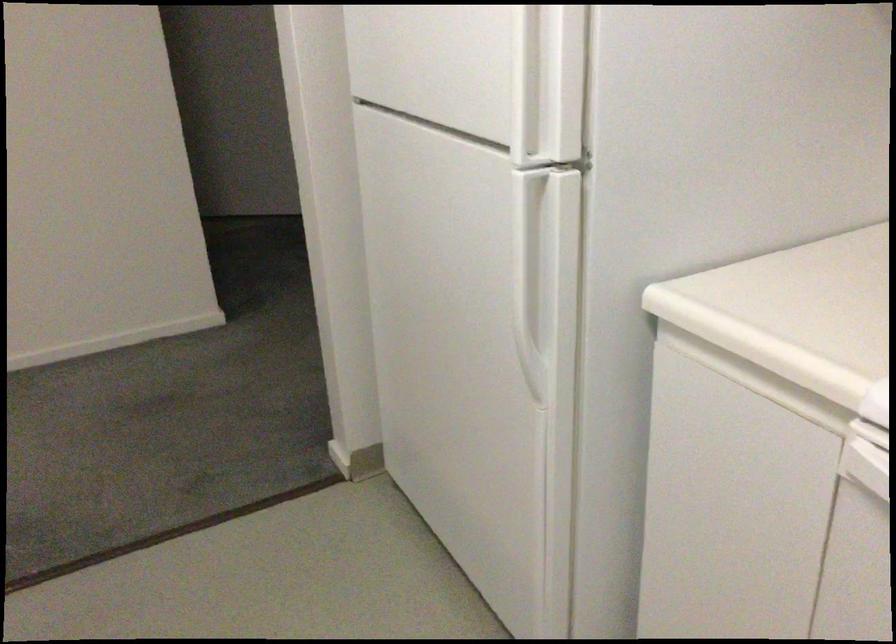
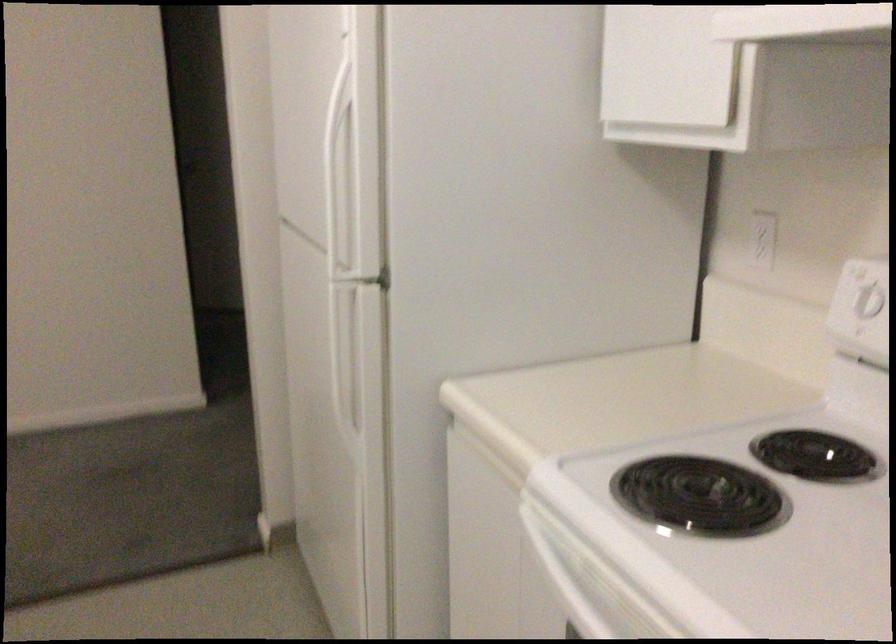
In the second image, find the point that corresponds to point 521,265 in the first image.

(349, 361)